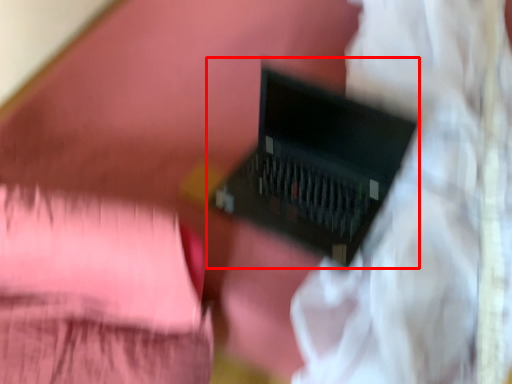
Question: From the image, what is the correct spatial relationship of computer (annotated by the red box) in relation to curtain?

Choices:
 (A) right
 (B) left

Answer: (B)